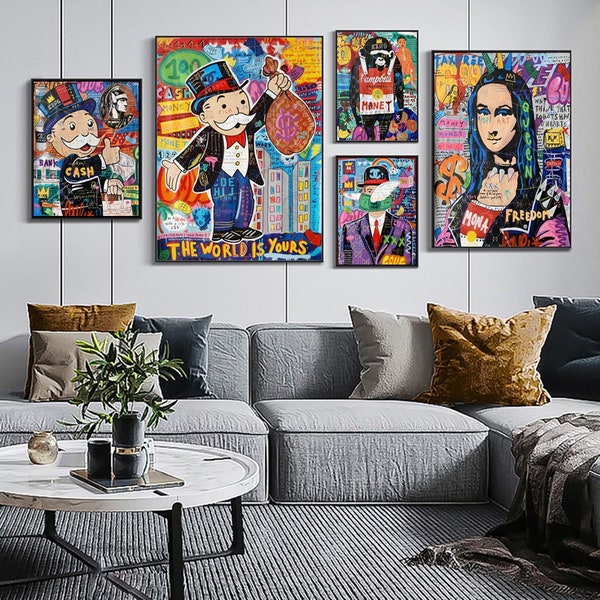
Where is `throw blanket`? This screenshot has height=600, width=600. throw blanket is located at coordinates (571, 440).